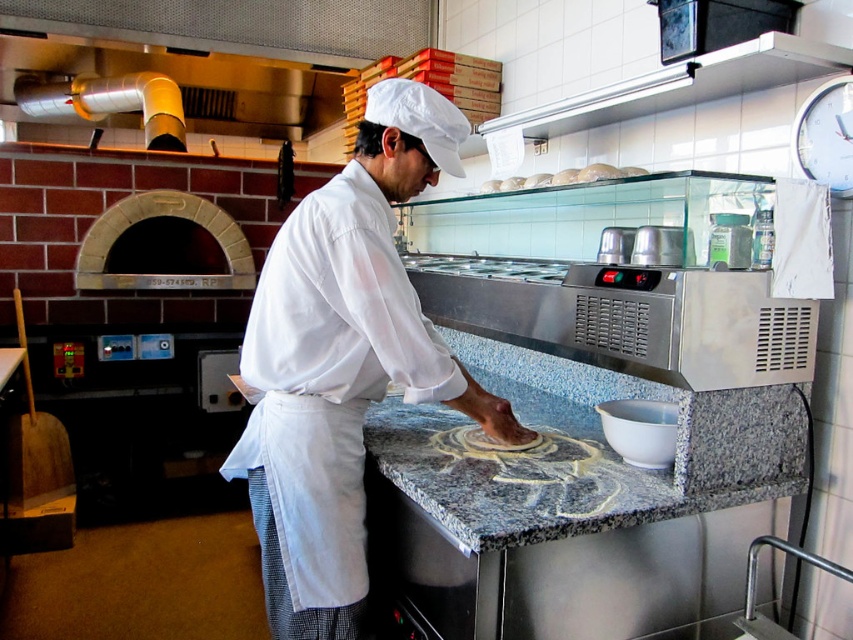
Can you confirm if white cotton apron at center is taller than white matte bread at upper center?

Indeed, white cotton apron at center has a greater height compared to white matte bread at upper center.

Which is below, white cotton apron at center or white matte bread at upper center?

white cotton apron at center is below.

Measure the distance between white cotton apron at center and camera.

white cotton apron at center is 1.32 meters from camera.

Locate an element on the screen. The height and width of the screenshot is (640, 853). white cotton apron at center is located at coordinates (328, 396).